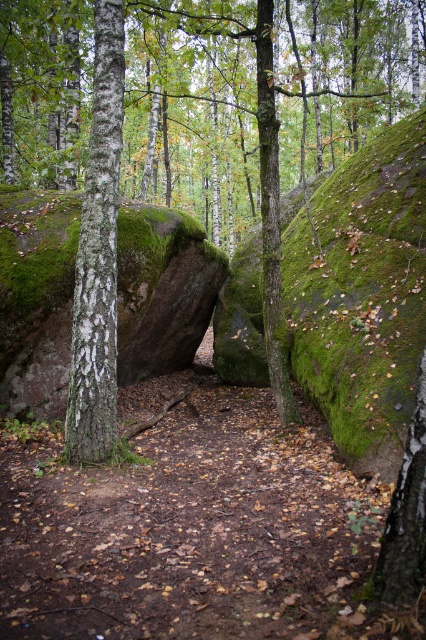
Question: Is green bark tree at center to the right of green mossy tree trunk at center from the viewer's perspective?

Choices:
 (A) no
 (B) yes

Answer: (A)

Question: Based on their relative distances, which object is nearer to the white bark tree trunk at center?

Choices:
 (A) green bark tree at center
 (B) green mossy tree trunk at center

Answer: (B)

Question: Is green bark tree at center to the right of green mossy tree trunk at center from the viewer's perspective?

Choices:
 (A) yes
 (B) no

Answer: (B)

Question: Among these objects, which one is nearest to the camera?

Choices:
 (A) white bark tree trunk at center
 (B) green mossy tree trunk at center

Answer: (A)

Question: Considering the real-world distances, which object is closest to the green bark tree at center?

Choices:
 (A) green mossy tree trunk at center
 (B) white bark tree trunk at center

Answer: (A)

Question: Does green bark tree at center have a greater width compared to green mossy tree trunk at center?

Choices:
 (A) no
 (B) yes

Answer: (B)